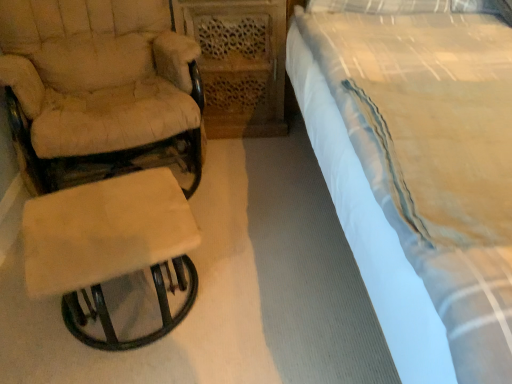
What are the coordinates of `unoccupied region to the right of beige fabric stool at left` in the screenshot? It's located at (257, 296).